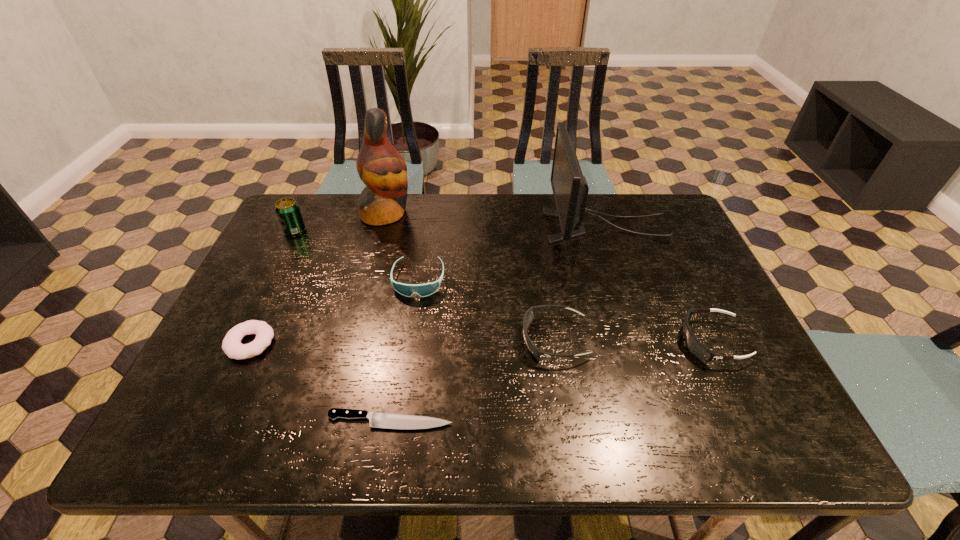
In order to click on computer monitor that is at the right edge in this screenshot , I will do `click(570, 189)`.

Identify the location of goggles situated at the right edge. The height and width of the screenshot is (540, 960). (693, 344).

The image size is (960, 540). Find the location of `object located in the far left corner section of the desktop`. object located in the far left corner section of the desktop is located at coordinates (287, 210).

I want to click on object located at the far right corner, so click(570, 189).

Locate an element on the screen. Image resolution: width=960 pixels, height=540 pixels. vacant point at the far edge is located at coordinates (625, 235).

In the image, there is a desktop. Where is `free space at the near edge`? free space at the near edge is located at coordinates (512, 422).

What are the coordinates of `blank space at the left edge of the desktop` in the screenshot? It's located at (296, 307).

Find the location of a particular element. The image size is (960, 540). vacant space at the far left corner of the desktop is located at coordinates (308, 214).

At what (x,y) coordinates should I click in order to perform the action: click on free space at the near right corner of the desktop. Please return your answer as a coordinate pair (x, y). The image size is (960, 540). Looking at the image, I should click on (801, 437).

This screenshot has width=960, height=540. What are the coordinates of `vacant region between the steak knife and the second goggles from left to right` in the screenshot? It's located at (472, 380).